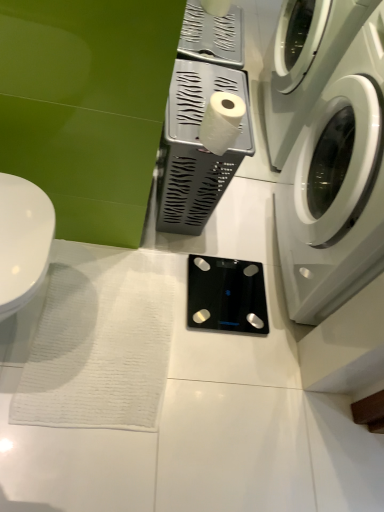
Locate an element on the screen. The image size is (384, 512). space that is in front of white glossy washing machine at right is located at coordinates (247, 365).